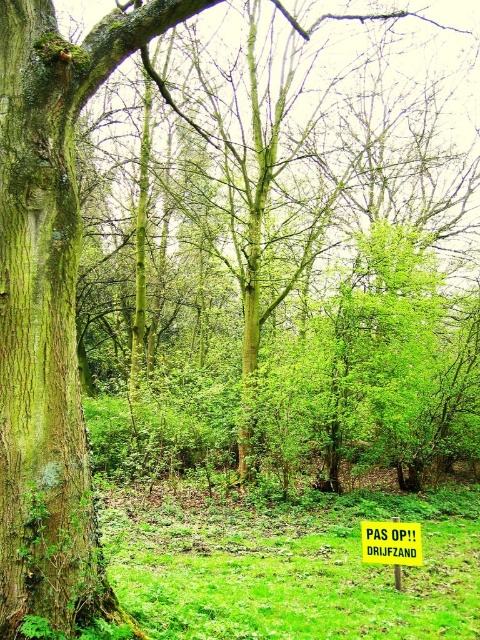
You are a hiker carrying a backpack and need to place your water bottle on the ground. You see the green grass at lower center and the yellow rectangular sign at center. Which location is closer to you?

The green grass at lower center is closer to you since it is only 1.96 meters away from the yellow rectangular sign at center, but without knowing your exact position, we can only determine their relative distance from each other.

Looking at this image, you are standing in the forest scene described. You notice a point marked at coordinates (290,564). What is located at that specific point?

The point at (290,564) is occupied by green grass at lower center.